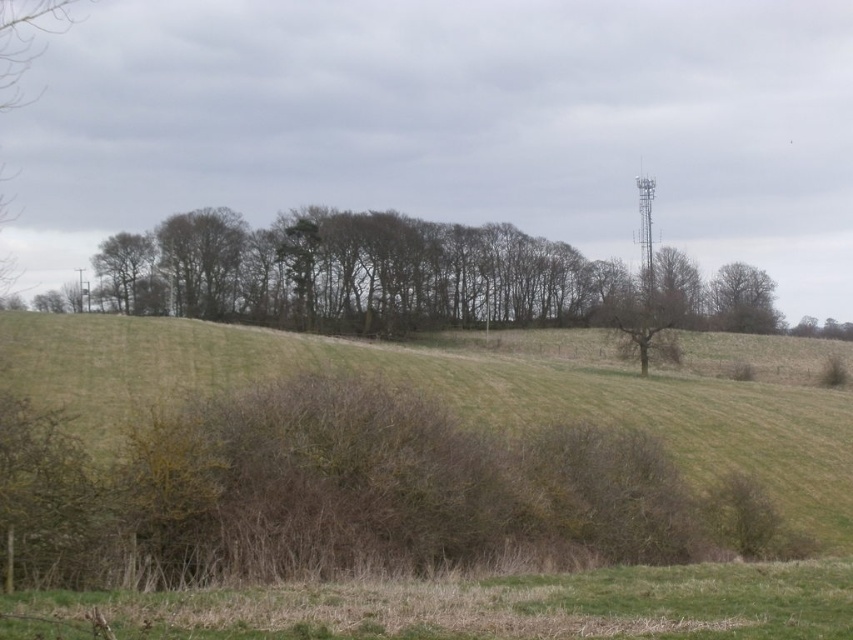
Question: Is green grassy hillside at center positioned in front of brown textured tree at upper right?

Choices:
 (A) no
 (B) yes

Answer: (B)

Question: Which point is farther to the camera?

Choices:
 (A) green leafy tree at upper left
 (B) green grassy hillside at center
 (C) brown textured tree at upper right

Answer: (C)

Question: Is the position of green grassy hillside at center less distant than that of brown textured tree at upper right?

Choices:
 (A) yes
 (B) no

Answer: (A)

Question: Among these objects, which one is farthest from the camera?

Choices:
 (A) green leafy tree at upper left
 (B) brown textured tree at upper right
 (C) green grassy hillside at center

Answer: (B)

Question: Is green grassy hillside at center to the right of green leafy tree at upper left from the viewer's perspective?

Choices:
 (A) yes
 (B) no

Answer: (A)

Question: Which object is positioned closest to the brown textured tree at upper right?

Choices:
 (A) green grassy hillside at center
 (B) green leafy tree at upper left

Answer: (A)